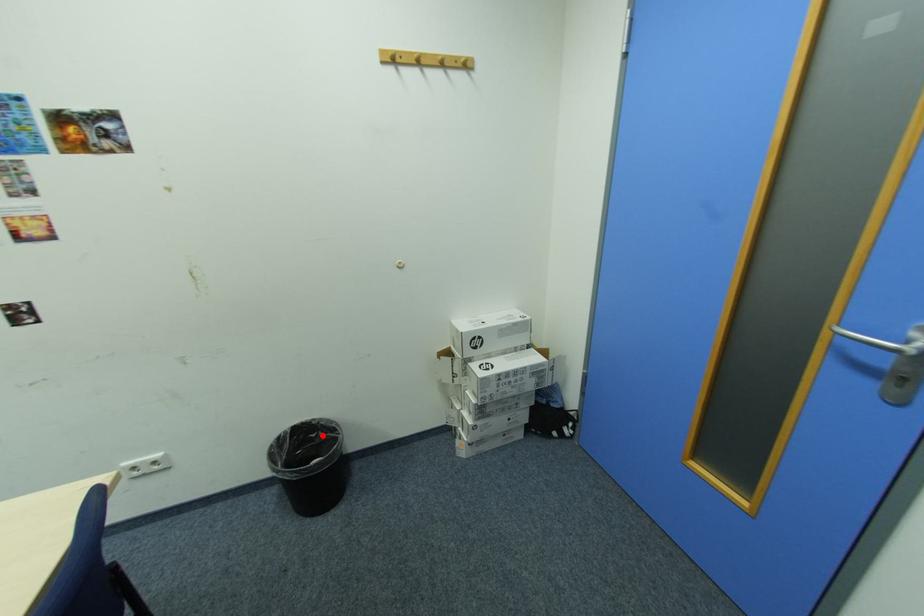
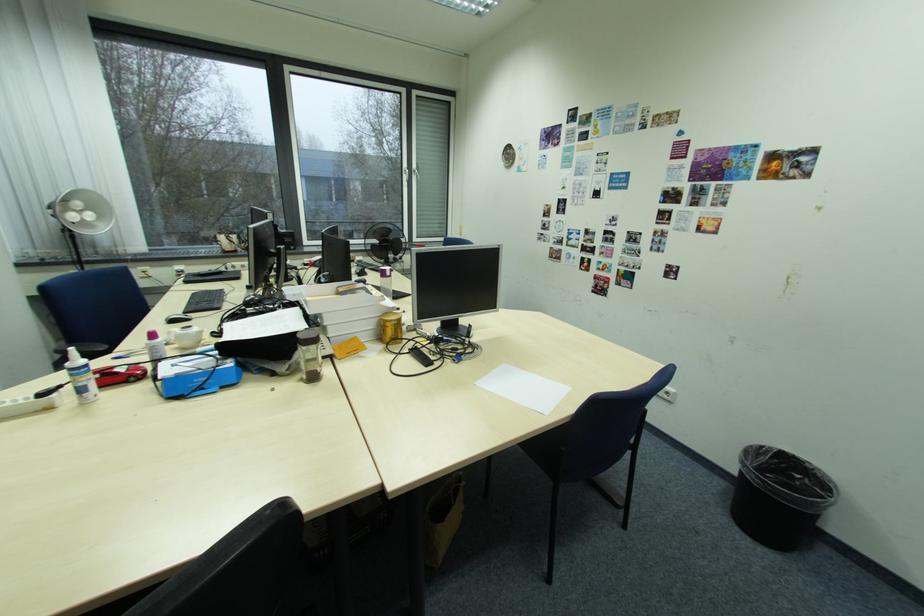
Question: A red point is marked in image1. In image2, is the corresponding 3D point closer to the camera or farther? Reply with the corresponding letter.

Choices:
 (A) The corresponding 3D point is closer.
 (B) The corresponding 3D point is farther.

Answer: (A)